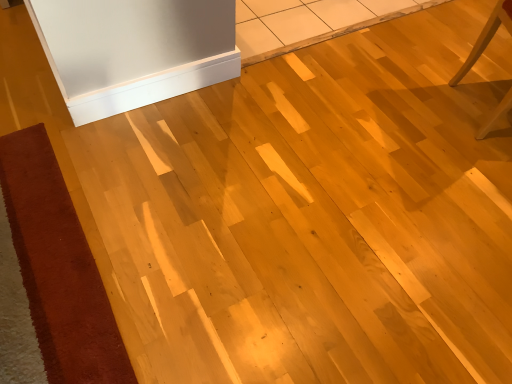
Question: Can light wood chair at right be found inside velvet-like brown mat at lower left?

Choices:
 (A) no
 (B) yes

Answer: (A)

Question: Considering the relative sizes of velvet-like brown mat at lower left and light wood chair at right in the image provided, is velvet-like brown mat at lower left wider than light wood chair at right?

Choices:
 (A) no
 (B) yes

Answer: (B)

Question: Is velvet-like brown mat at lower left to the left of light wood chair at right from the viewer's perspective?

Choices:
 (A) yes
 (B) no

Answer: (A)

Question: Would you say velvet-like brown mat at lower left is a long distance from light wood chair at right?

Choices:
 (A) no
 (B) yes

Answer: (B)

Question: From the image's perspective, does velvet-like brown mat at lower left appear higher than light wood chair at right?

Choices:
 (A) no
 (B) yes

Answer: (A)

Question: From a real-world perspective, is velvet-like brown mat at lower left positioned under light wood chair at right based on gravity?

Choices:
 (A) no
 (B) yes

Answer: (B)

Question: Is white glossy baseboard at upper center positioned far away from light wood chair at right?

Choices:
 (A) no
 (B) yes

Answer: (B)

Question: Is white glossy baseboard at upper center positioned behind light wood chair at right?

Choices:
 (A) yes
 (B) no

Answer: (A)

Question: Can you confirm if white glossy baseboard at upper center is taller than light wood chair at right?

Choices:
 (A) no
 (B) yes

Answer: (A)

Question: From the image's perspective, is white glossy baseboard at upper center on light wood chair at right?

Choices:
 (A) no
 (B) yes

Answer: (A)

Question: Considering the relative sizes of white glossy baseboard at upper center and light wood chair at right in the image provided, is white glossy baseboard at upper center smaller than light wood chair at right?

Choices:
 (A) no
 (B) yes

Answer: (B)

Question: Is the surface of white glossy baseboard at upper center in direct contact with light wood chair at right?

Choices:
 (A) no
 (B) yes

Answer: (A)

Question: From the image's perspective, is velvet-like brown mat at lower left located above white glossy baseboard at upper center?

Choices:
 (A) yes
 (B) no

Answer: (B)